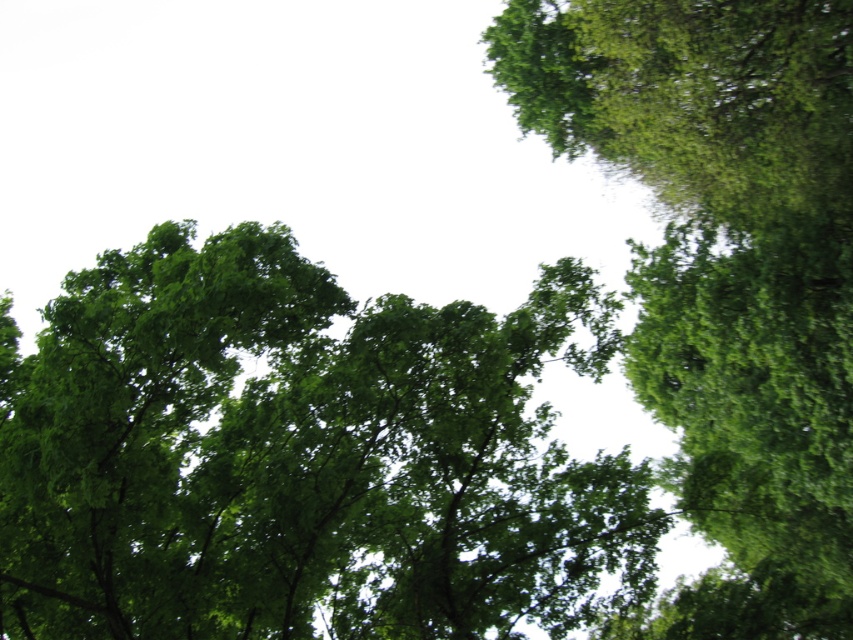
Measure the distance from green leafy tree at center to green leafy tree at upper right.

green leafy tree at center and green leafy tree at upper right are 12.17 feet apart.

Does green leafy tree at center appear under green leafy tree at upper right?

Correct, green leafy tree at center is located below green leafy tree at upper right.

Who is more distant from viewer, (561,538) or (831,483)?

Positioned behind is point (831,483).

Where is `green leafy tree at center`? The image size is (853, 640). green leafy tree at center is located at coordinates (299, 456).